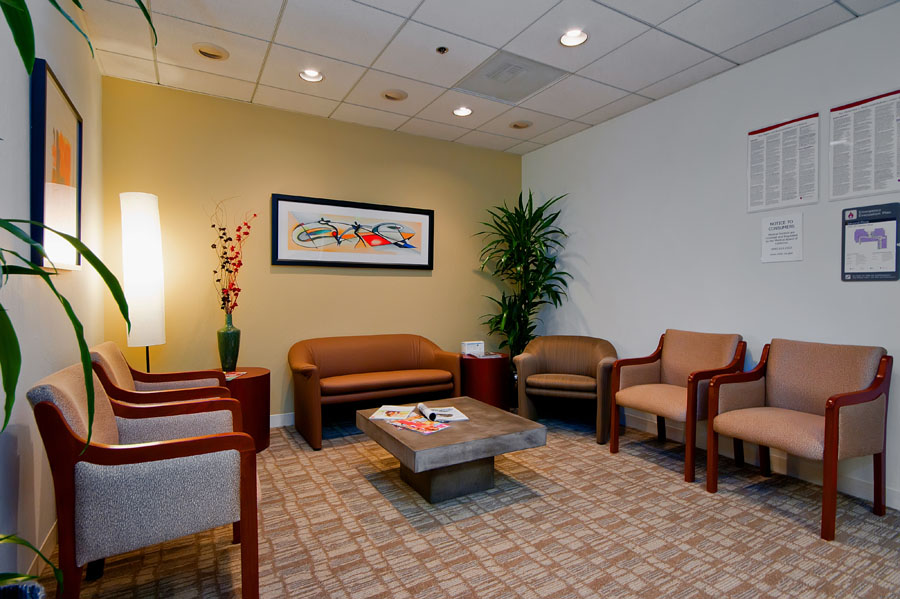
Image resolution: width=900 pixels, height=599 pixels. Identify the location of floor. (607, 495).